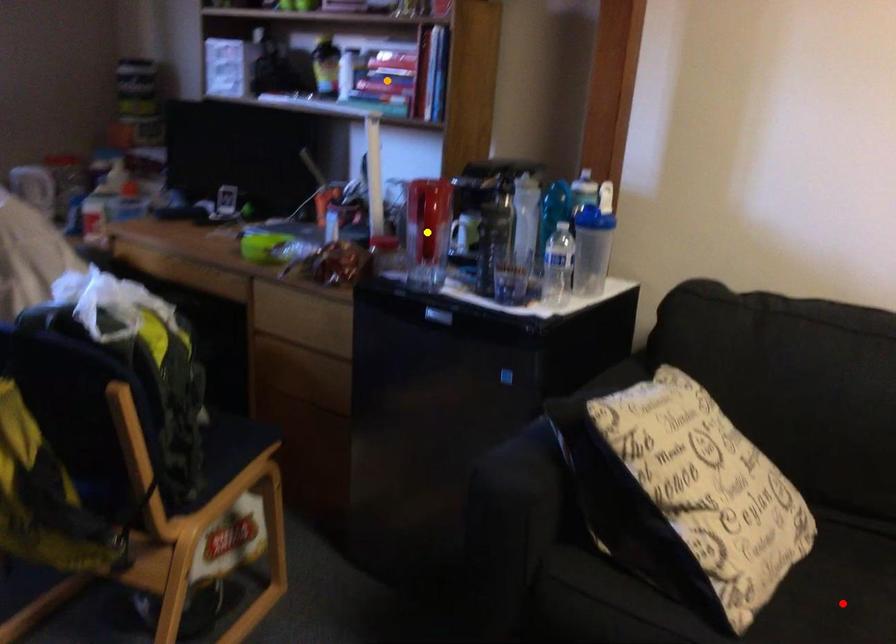
Order these from farthest to nearest:
red point | orange point | yellow point

orange point
yellow point
red point